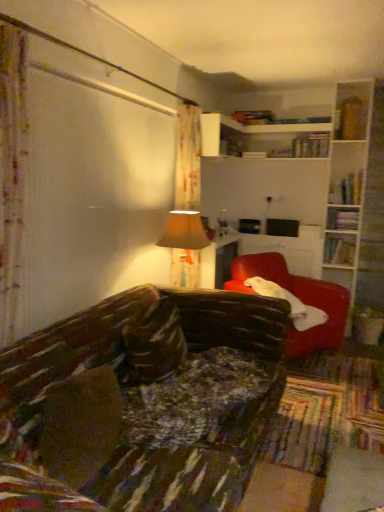
Question: Is hardcover book at upper right, which is counted as the second book, starting from the right, bigger or smaller than matte red armchair at right?

Choices:
 (A) small
 (B) big

Answer: (A)

Question: Relative to matte red armchair at right, is hardcover book at upper right, the fourth book viewed from the top, in front or behind?

Choices:
 (A) behind
 (B) front

Answer: (A)

Question: Which object is the closest to the hardcover book at upper right, the fourth book viewed from the top?

Choices:
 (A) hardcover book at upper right, the 3th book in the right-to-left sequence
 (B) matte red armchair at right
 (C) hardcover books at upper right, arranged as the third book when ordered from the bottom
 (D) hardcover book at upper center, the 1th book when ordered from top to bottom
 (E) beige fabric lampshade at center

Answer: (A)

Question: Considering the real-world distances, which object is farthest from the hardcover book at upper right, which appears as the second book when viewed from the left?

Choices:
 (A) hardcover book at upper right, the first book positioned from the bottom
 (B) beige fabric lampshade at center
 (C) matte red armchair at right
 (D) hardcover book at upper center, the fourth book in the bottom-to-top sequence
 (E) hardcover books at upper right, arranged as the third book when ordered from the bottom

Answer: (B)